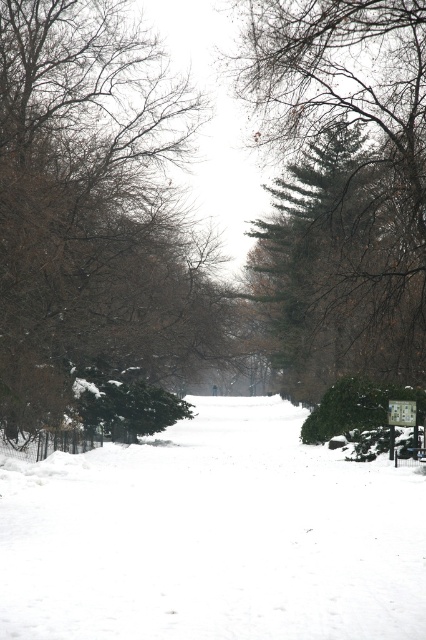
You are standing at point (363, 186) and want to walk to the park entrance located at point (379, 476). Is the park entrance in front of you or behind you?

The park entrance at point (379, 476) is in front of you because it is located in front of point (363, 186) where you are standing.